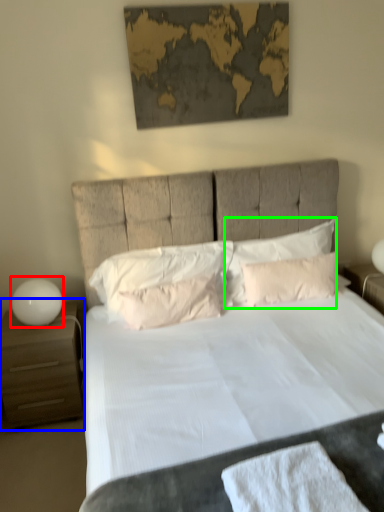
Question: Which is farther away from table lamp (highlighted by a red box)? nightstand (highlighted by a blue box) or pillow (highlighted by a green box)?

Choices:
 (A) nightstand
 (B) pillow

Answer: (B)